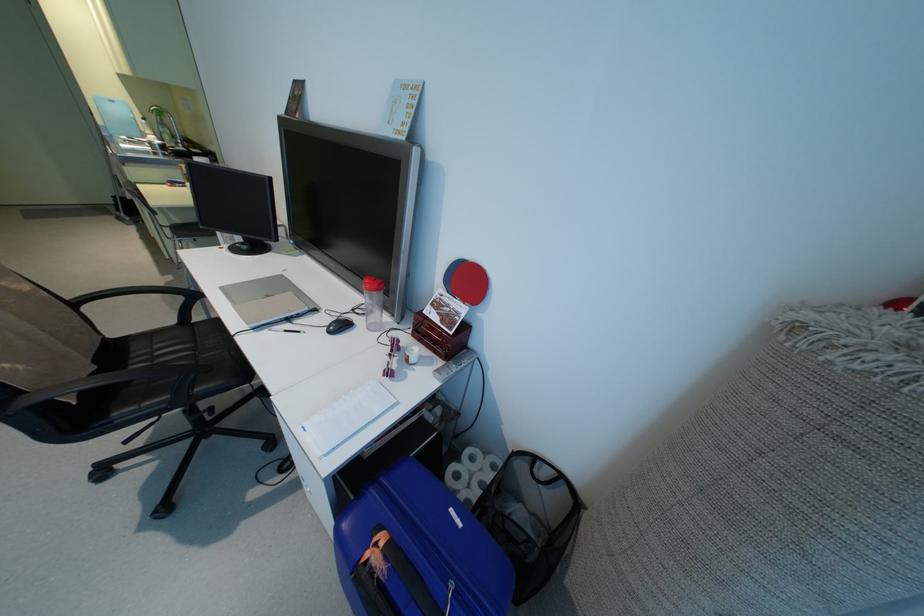
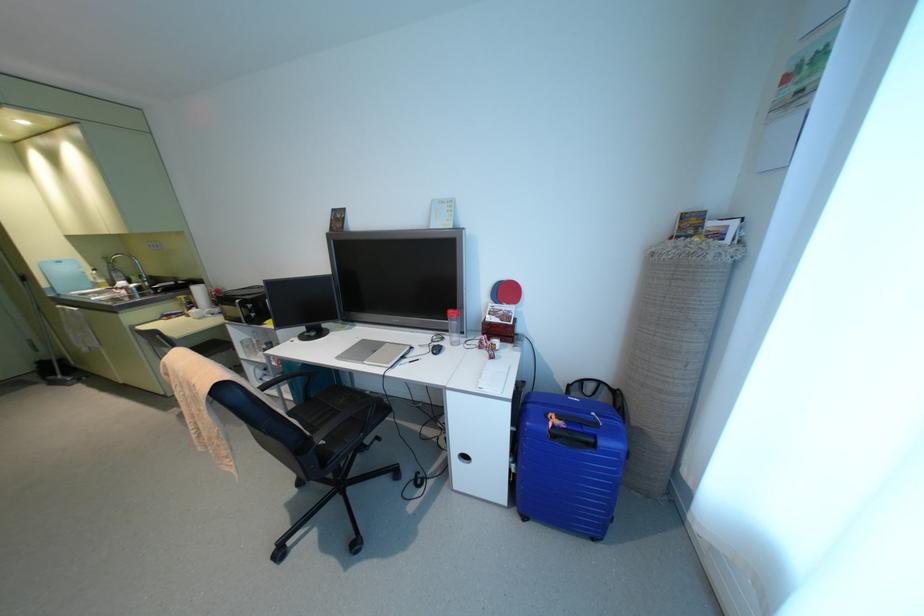
Where in the second image is the point corresponding to (163,147) from the first image?

(139, 288)